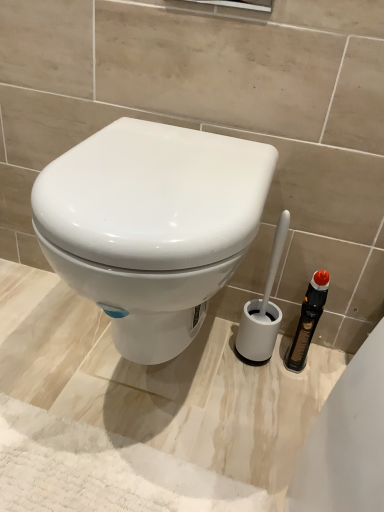
Identify the location of free space in front of white plastic toilet brush at right. The height and width of the screenshot is (512, 384). (245, 406).